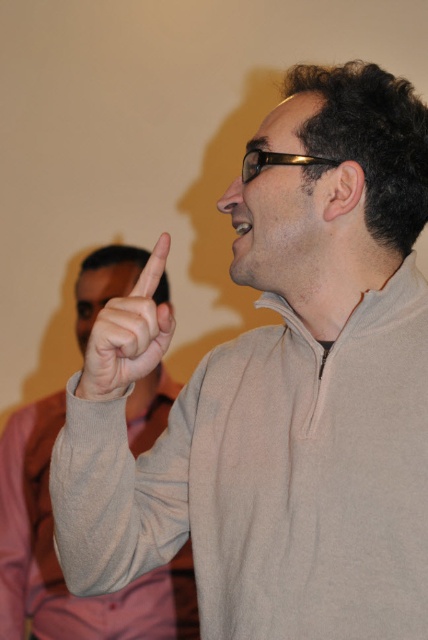
Question: Which point is farther to the camera?

Choices:
 (A) gray wool sweater at upper center
 (B) matte gray finger at upper center

Answer: (A)

Question: Does gray wool sweater at upper center appear over matte gray finger at upper center?

Choices:
 (A) yes
 (B) no

Answer: (B)

Question: Which point is farther from the camera taking this photo?

Choices:
 (A) (2, 538)
 (B) (104, 396)

Answer: (A)

Question: Does gray wool sweater at upper center have a greater width compared to matte gray finger at upper center?

Choices:
 (A) yes
 (B) no

Answer: (A)

Question: Is gray wool sweater at upper center further to camera compared to matte gray finger at upper center?

Choices:
 (A) no
 (B) yes

Answer: (B)